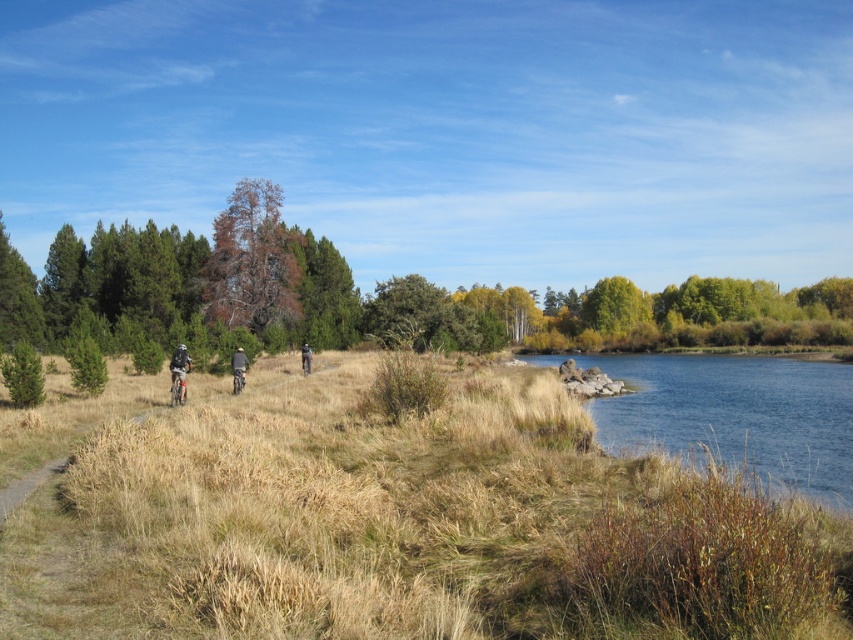
You are a hiker standing on the path and see the metallic silver mountain bike at left and the dark gray jacket at center. Which object is closer to the ground?

The metallic silver mountain bike at left is closer to the ground because it is located below the dark gray jacket at center.

You are a photographer standing in the middle of the dirt path. You want to take a photo of the dark gray jacket at center and the brown textured tree at center. Which object is closer to you?

The dark gray jacket at center is behind the brown textured tree at center, so the brown textured tree at center is closer to you.